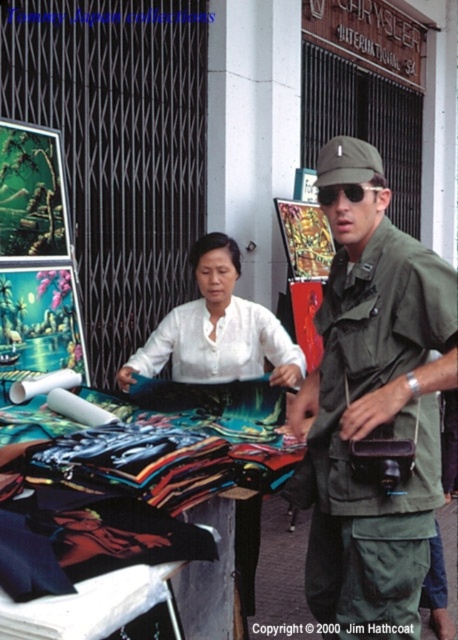
Question: Is the position of green matte uniform at center more distant than that of white matte shirt at center?

Choices:
 (A) yes
 (B) no

Answer: (B)

Question: Can you confirm if green matte uniform at center is positioned below white matte shirt at center?

Choices:
 (A) yes
 (B) no

Answer: (A)

Question: Which point is closer to the camera?

Choices:
 (A) [x=203, y=269]
 (B) [x=382, y=499]

Answer: (B)

Question: Is green matte uniform at center to the left of white matte shirt at center from the viewer's perspective?

Choices:
 (A) no
 (B) yes

Answer: (A)